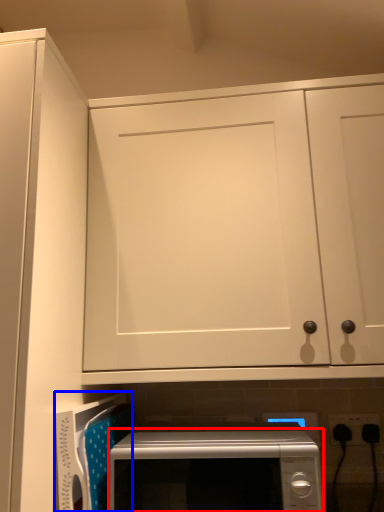
Question: Which point is further to the camera, microwave oven (highlighted by a red box) or appliance (highlighted by a blue box)?

Choices:
 (A) microwave oven
 (B) appliance

Answer: (B)